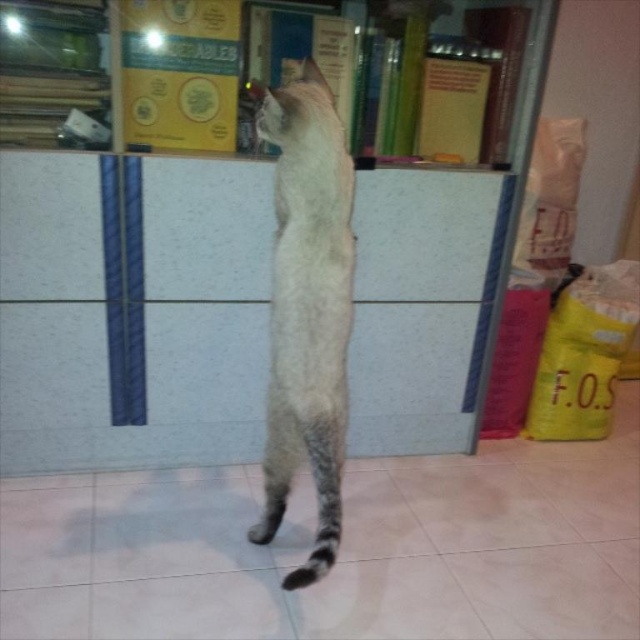
You are a cat lover who wants to know if the white textured bookshelf at upper center can hold the gray striped tail at lower center. Based on their sizes, what do you think?

The white textured bookshelf at upper center is bigger than the gray striped tail at lower center, so it can hold the gray striped tail at lower center.

From the picture: The cat is standing at point (307, 308). What is the cat doing?

The cat is standing upright on its hind legs facing the bookshelf, showing curiosity or attentiveness towards something on the shelf.